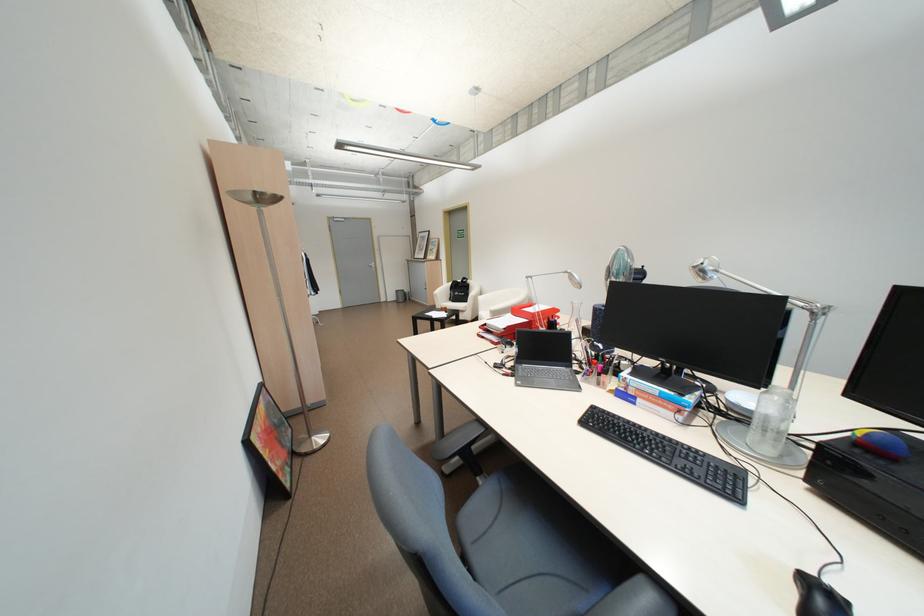
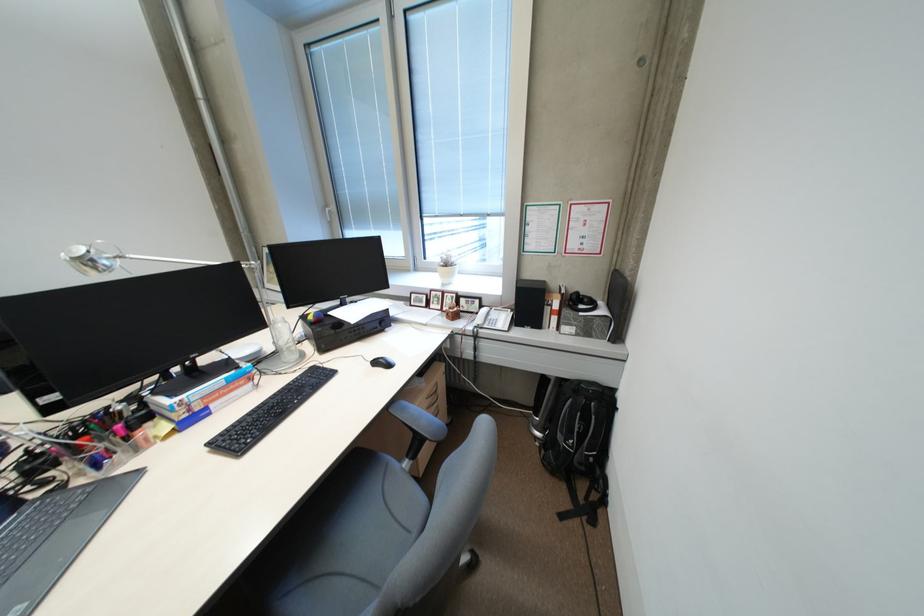
The point at [704,267] is marked in the first image. Where is the corresponding point in the second image?

(90, 257)